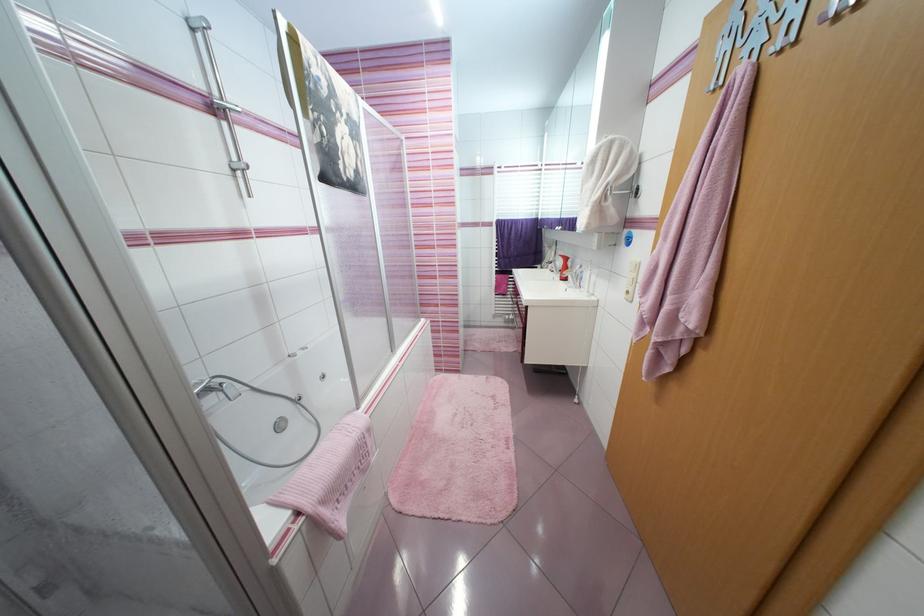
This screenshot has width=924, height=616. Describe the element at coordinates (564, 267) in the screenshot. I see `a red dispenser pump` at that location.